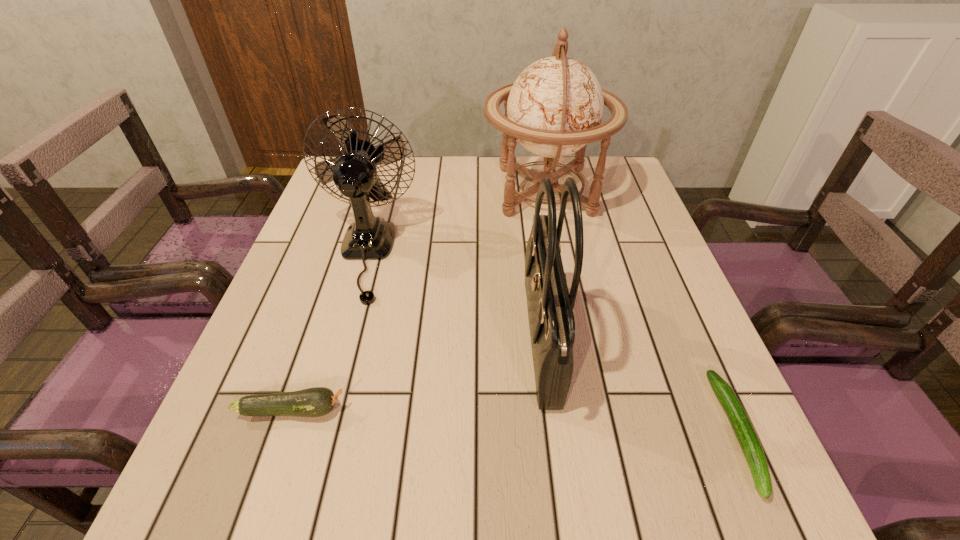
What are the coordinates of `zucchini positioned at the right edge` in the screenshot? It's located at (744, 431).

The width and height of the screenshot is (960, 540). Identify the location of object situated at the far right corner. (555, 107).

The width and height of the screenshot is (960, 540). Find the location of `object at the near right corner`. object at the near right corner is located at coordinates (744, 431).

The width and height of the screenshot is (960, 540). I want to click on vacant space at the far edge of the desktop, so click(x=409, y=160).

This screenshot has height=540, width=960. Identify the location of blank space at the near edge of the desktop. (473, 507).

This screenshot has width=960, height=540. What are the coordinates of `blank space at the left edge of the desktop` in the screenshot? It's located at (309, 449).

In order to click on vacant area at the right edge in this screenshot , I will do `click(629, 237)`.

Image resolution: width=960 pixels, height=540 pixels. Identify the location of vacant space at the far right corner. (606, 174).

The width and height of the screenshot is (960, 540). I want to click on vacant space in between the globe and the rightmost object, so click(641, 312).

Find the location of a particular element. vacant space that is in between the second shortest object and the handbag is located at coordinates (417, 376).